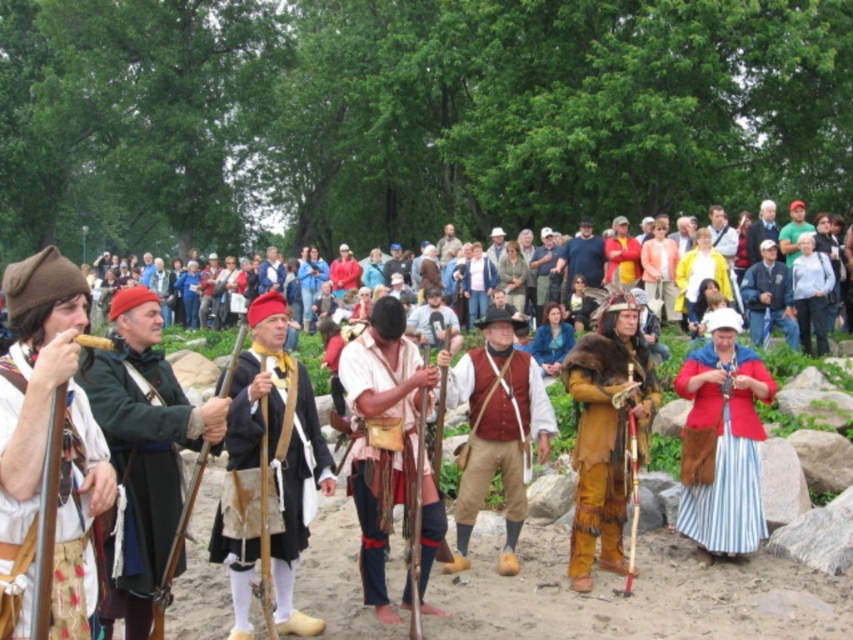
Is point (242, 486) farther from viewer compared to point (718, 524)?

No, it is not.

Identify the location of black leather coat at center. coord(271,481).

Between blue denim jacket at center and light blue denim jacket at center, which one has more height?

light blue denim jacket at center is taller.

Between blue denim jacket at center and light blue denim jacket at center, which one is positioned lower?

blue denim jacket at center

Image resolution: width=853 pixels, height=640 pixels. Describe the element at coordinates (769, 298) in the screenshot. I see `blue denim jacket at center` at that location.

This screenshot has height=640, width=853. I want to click on blue denim jacket at center, so click(x=769, y=298).

Measure the distance between red cotton dress at center and blue denim jacket at center.

red cotton dress at center and blue denim jacket at center are 9.12 meters apart from each other.

Looking at this image, can you confirm if red cotton dress at center is wider than blue denim jacket at center?

In fact, red cotton dress at center might be narrower than blue denim jacket at center.

Measure the distance between point (x=727, y=472) and camera.

Point (x=727, y=472) is 10.83 meters away from camera.

Locate an element on the screen. Image resolution: width=853 pixels, height=640 pixels. red cotton dress at center is located at coordinates (722, 444).